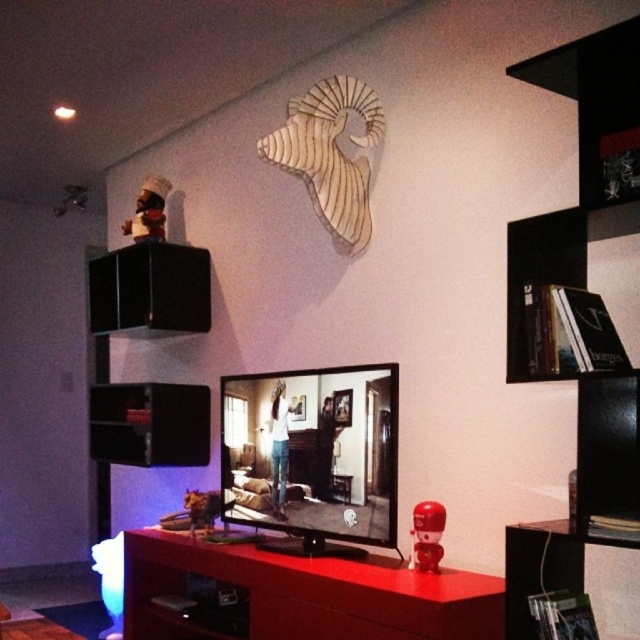
Consider the image. You are standing in the living room and want to place a 5 feet long decorative item on the black plastic shelf at lower right. Can you determine if the shelf is far enough away from you to safely place the item without it hitting the TV or other furniture?

The black plastic shelf at lower right is 4.83 feet away from the camera. Since the decorative item is 5 feet long, placing it might require careful positioning to ensure it doesn not extend beyond the shelf and hit nearby objects like the TV or other furniture. The distance is close, so caution is advised.

You are standing in the living room and want to adjust the volume of the black matte speaker at upper left. If you can reach up to 2 meters, can you comfortably adjust it without moving closer?

The black matte speaker at upper left is 3.38 meters away from the camera, which is beyond your reach of 2 meters. You would need to move closer to adjust it.

You are a delivery person who just arrived at the apartment. You need to place a package on the smooth glossy tv at center without blocking the view of the matte red robot at lower right. Is this possible?

The matte red robot at lower right is behind the smooth glossy tv at center, so placing the package on the smooth glossy tv at center would block the view of the matte red robot at lower right. Therefore, it is not possible to place the package there without blocking the view.